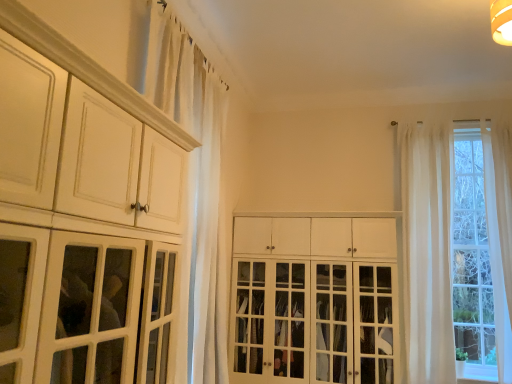
Question: Considering the relative sizes of white sheer curtain at upper left and sheer white curtains at right in the image provided, is white sheer curtain at upper left taller than sheer white curtains at right?

Choices:
 (A) no
 (B) yes

Answer: (A)

Question: Is white sheer curtain at upper left oriented away from sheer white curtains at right?

Choices:
 (A) yes
 (B) no

Answer: (B)

Question: Does white sheer curtain at upper left have a greater width compared to sheer white curtains at right?

Choices:
 (A) yes
 (B) no

Answer: (B)

Question: Can you confirm if white sheer curtain at upper left is bigger than sheer white curtains at right?

Choices:
 (A) no
 (B) yes

Answer: (B)

Question: From a real-world perspective, does white sheer curtain at upper left stand above sheer white curtains at right?

Choices:
 (A) yes
 (B) no

Answer: (A)

Question: Is white sheer curtain at upper left surrounding sheer white curtains at right?

Choices:
 (A) no
 (B) yes

Answer: (A)

Question: Is sheer white curtains at right oriented towards white wood cabinet at center, marked as the second cabinetry in a front-to-back arrangement?

Choices:
 (A) yes
 (B) no

Answer: (B)

Question: Considering the relative sizes of sheer white curtains at right and white wood cabinet at center, marked as the second cabinetry in a front-to-back arrangement, in the image provided, is sheer white curtains at right taller than white wood cabinet at center, marked as the second cabinetry in a front-to-back arrangement,?

Choices:
 (A) no
 (B) yes

Answer: (B)

Question: Does sheer white curtains at right have a larger size compared to white wood cabinet at center, marked as the second cabinetry in a front-to-back arrangement?

Choices:
 (A) yes
 (B) no

Answer: (B)

Question: Does sheer white curtains at right contain white wood cabinet at center, the first cabinetry viewed from the back?

Choices:
 (A) no
 (B) yes

Answer: (A)

Question: Is sheer white curtains at right smaller than white wood cabinet at center, placed as the first cabinetry when sorted from right to left?

Choices:
 (A) yes
 (B) no

Answer: (A)

Question: Does sheer white curtains at right come behind white wood cabinet at center, the first cabinetry viewed from the back?

Choices:
 (A) yes
 (B) no

Answer: (A)

Question: Is white sheer curtain at upper left to the right of white wood cabinet at center, the first cabinetry viewed from the back, from the viewer's perspective?

Choices:
 (A) yes
 (B) no

Answer: (B)